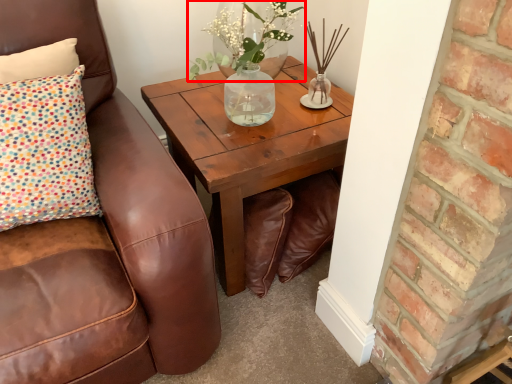
Question: From the image's perspective, considering the relative positions of floral arrangement (annotated by the red box) and coffee table in the image provided, where is floral arrangement (annotated by the red box) located with respect to the staircase?

Choices:
 (A) above
 (B) below

Answer: (A)